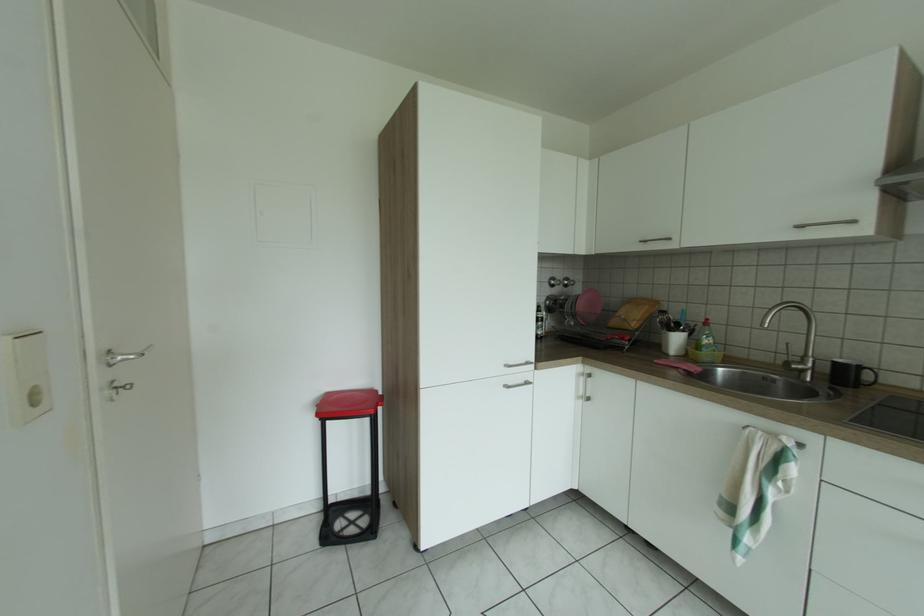
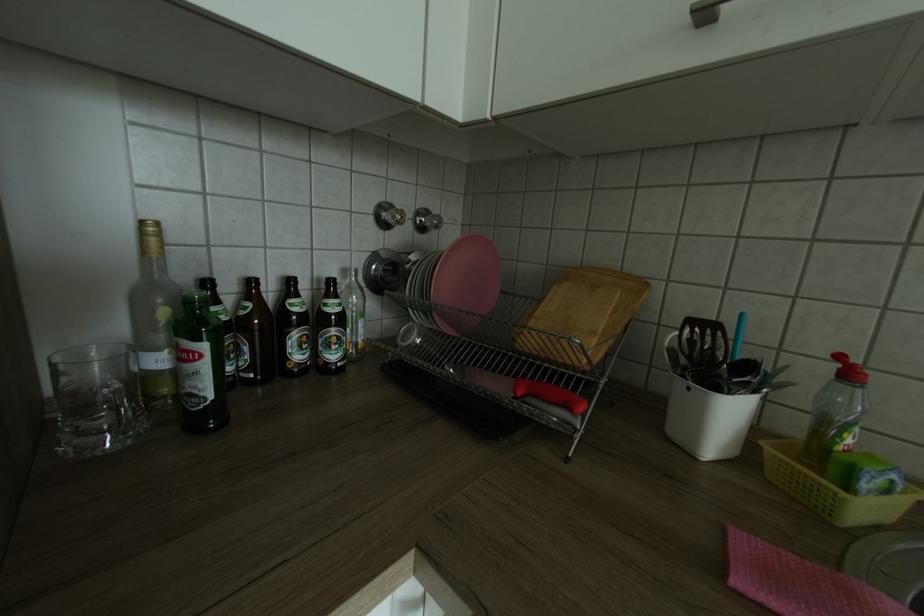
The images are taken continuously from a first-person perspective. In which direction are you moving?

The movement direction of the cameraman is right, forward.